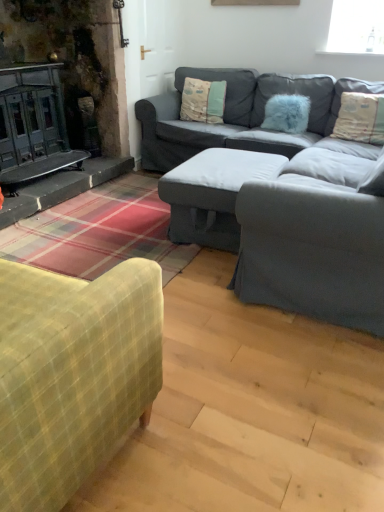
Question: Is fluffy cream pillow at upper right, which appears as the 1th pillow when viewed from the right, inside the boundaries of dark gray fabric couch at center, or outside?

Choices:
 (A) outside
 (B) inside

Answer: (B)

Question: In terms of width, does fluffy cream pillow at upper right, which appears as the 1th pillow when viewed from the right, look wider or thinner when compared to dark gray fabric couch at center?

Choices:
 (A) wide
 (B) thin

Answer: (B)

Question: Estimate the real-world distances between objects in this image. Which object is closer to the fluffy cream pillow at upper right, which appears as the 1th pillow when viewed from the right?

Choices:
 (A) dark gray fabric couch at center
 (B) textured beige pillow at center, acting as the third pillow starting from the right
 (C) textured gray armchair at center
 (D) velvet green sofa at center
 (E) white fabric ottoman at center

Answer: (A)

Question: Considering the real-world distances, which object is closest to the fluffy cream pillow at upper right, the third pillow positioned from the left?

Choices:
 (A) velvet green sofa at center
 (B) textured beige pillow at center, the first pillow in the left-to-right sequence
 (C) fuzzy blue pillow at center, which is the second pillow from left to right
 (D) dark gray fabric couch at center
 (E) textured gray armchair at center

Answer: (C)